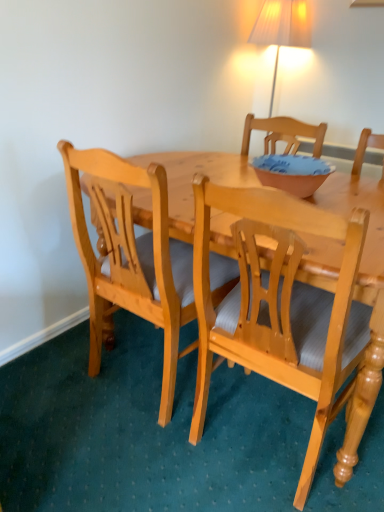
This screenshot has height=512, width=384. Identify the location of free point above matte pink bowl at center (from a real-world perspective). (294, 160).